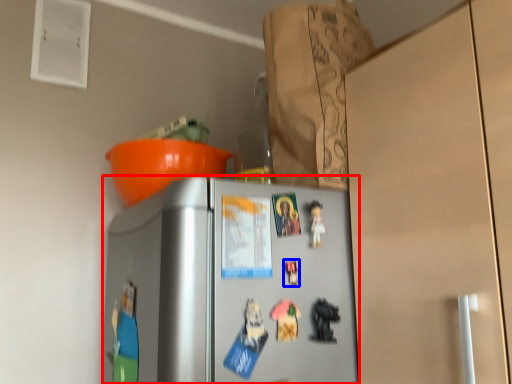
Question: Which object is closer to the camera taking this photo, refrigerator (highlighted by a red box) or toy (highlighted by a blue box)?

Choices:
 (A) refrigerator
 (B) toy

Answer: (A)